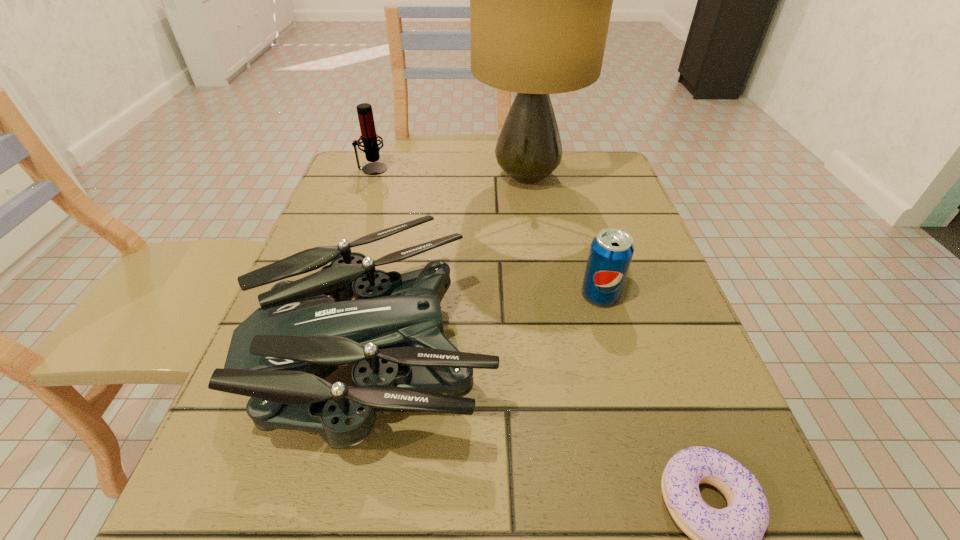
This screenshot has height=540, width=960. Find the location of `free location at the far left corner of the desktop`. free location at the far left corner of the desktop is located at coordinates (361, 162).

Locate an element on the screen. The height and width of the screenshot is (540, 960). free spot at the near left corner of the desktop is located at coordinates (179, 535).

The height and width of the screenshot is (540, 960). What are the coordinates of `empty location between the drone and the tallest object` in the screenshot? It's located at tap(452, 261).

Find the location of a particular element. The width and height of the screenshot is (960, 540). vacant region between the drone and the pop soda is located at coordinates (489, 320).

Where is `blank region between the drone and the pop soda`? blank region between the drone and the pop soda is located at coordinates (489, 320).

The image size is (960, 540). Find the location of `empty space between the tallest object and the second tallest object`. empty space between the tallest object and the second tallest object is located at coordinates (449, 173).

Find the location of `free space between the lampshade and the drone`. free space between the lampshade and the drone is located at coordinates (452, 261).

You are a GUI agent. You are given a task and a screenshot of the screen. Output one action in this format:
    pyautogui.click(x=<x>, y=<y>)
    Task: Click on the free space between the pop soda and the drone
    The height and width of the screenshot is (540, 960).
    Given the screenshot: What is the action you would take?
    pyautogui.click(x=489, y=320)

Identify the location of free point between the microphone and the tallest object. (449, 173).

You are a GUI agent. You are given a task and a screenshot of the screen. Output one action in this format:
    pyautogui.click(x=<x>, y=<y>)
    Task: Click on the object that is the closest one to the pop soda
    The width and height of the screenshot is (960, 540).
    Given the screenshot: What is the action you would take?
    pyautogui.click(x=279, y=356)